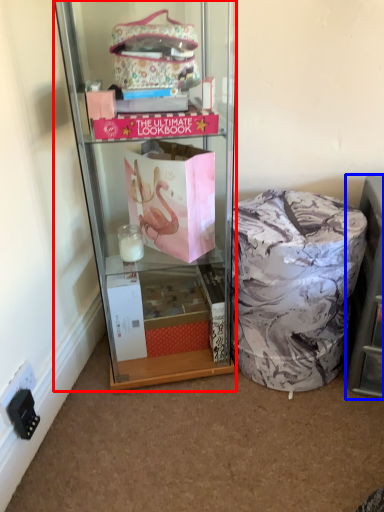
Question: Which point is further to the camera, cabinetry (highlighted by a red box) or shelf (highlighted by a blue box)?

Choices:
 (A) cabinetry
 (B) shelf

Answer: (B)